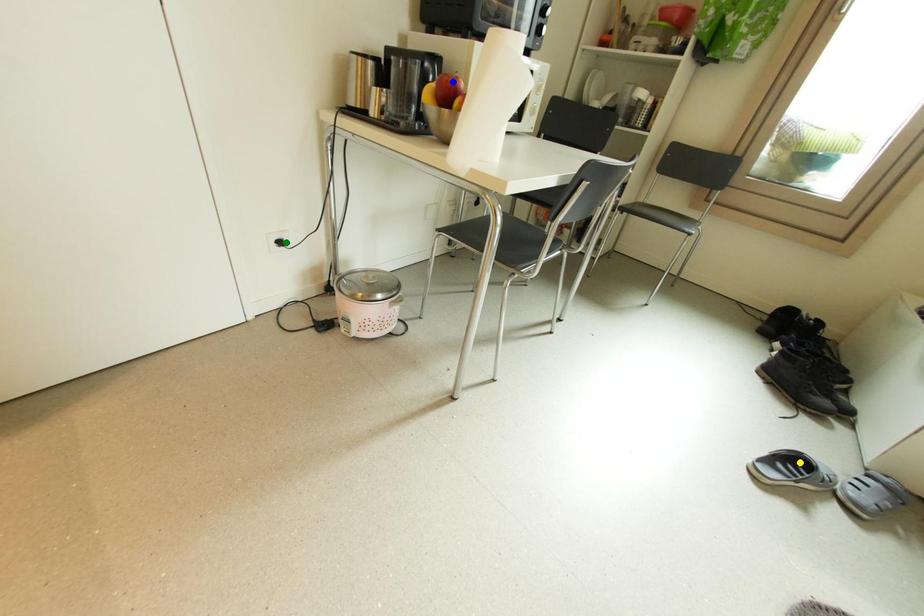
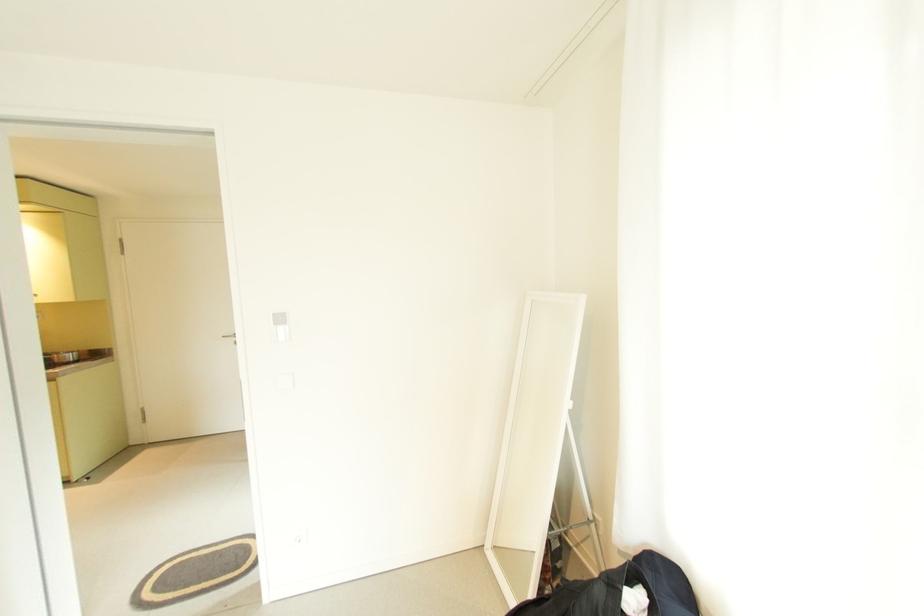
I am providing you with two images of the same scene from different viewpoints. Three points are marked in image1. Which point corresponds to a part or object that is occluded in image2?In image1, three points are marked. Which of them correspond to a part or object that is occluded in image2?Among the three points shown in image1, which one corresponds to a part or object that is no longer visible due to occlusion in image2?

blue point, green point, yellow point